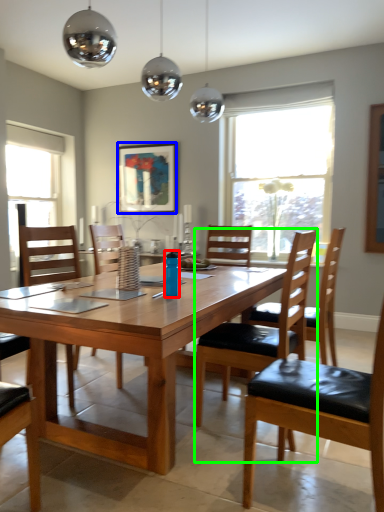
Question: Estimate the real-world distances between objects in this image. Which object is farther from bottle (highlighted by a red box), picture frame (highlighted by a blue box) or chair (highlighted by a green box)?

Choices:
 (A) picture frame
 (B) chair

Answer: (A)